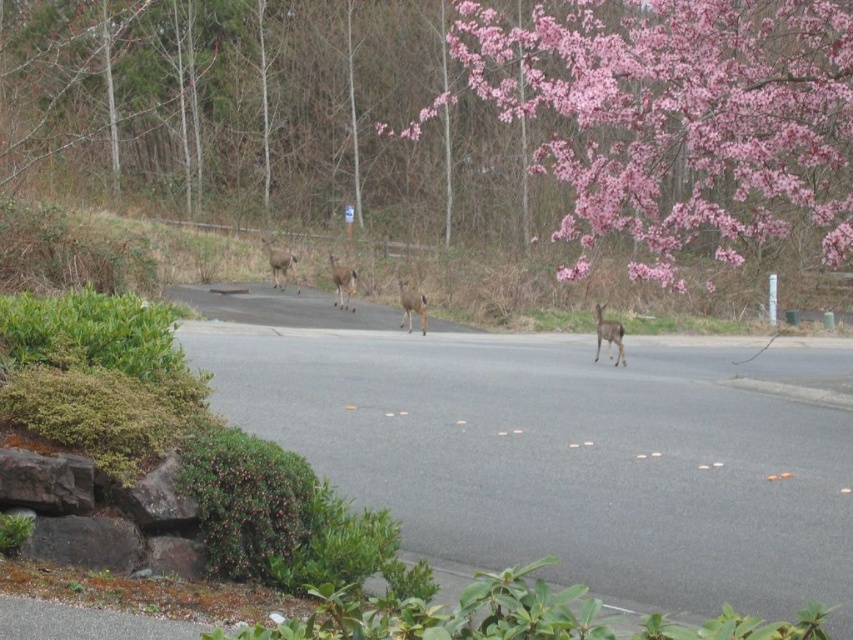
From the picture: Who is higher up, pink blossom tree at upper right or brown matte deer at center?

pink blossom tree at upper right is higher up.

Is pink blossom tree at upper right wider than brown matte deer at center?

Correct, the width of pink blossom tree at upper right exceeds that of brown matte deer at center.

Between point (387, 112) and point (405, 300), which one is positioned behind?

The point (387, 112) is behind.

Where is `pink blossom tree at upper right`? This screenshot has height=640, width=853. pink blossom tree at upper right is located at coordinates (451, 115).

Based on the photo, does brown matte/deer at center have a larger size compared to brown fur deer at center?

Yes.

Is point (340, 276) farther from viewer compared to point (277, 253)?

No, it is not.

At what (x,y) coordinates should I click in order to perform the action: click on brown matte/deer at center. Please return your answer as a coordinate pair (x, y). Image resolution: width=853 pixels, height=640 pixels. Looking at the image, I should click on (343, 284).

Can you confirm if brown furry deer at center is positioned to the left of brown matte deer at center?

Incorrect, brown furry deer at center is not on the left side of brown matte deer at center.

Is the position of brown furry deer at center less distant than that of brown matte deer at center?

Yes, brown furry deer at center is closer to the viewer.

Locate an element on the screen. This screenshot has width=853, height=640. brown furry deer at center is located at coordinates (608, 333).